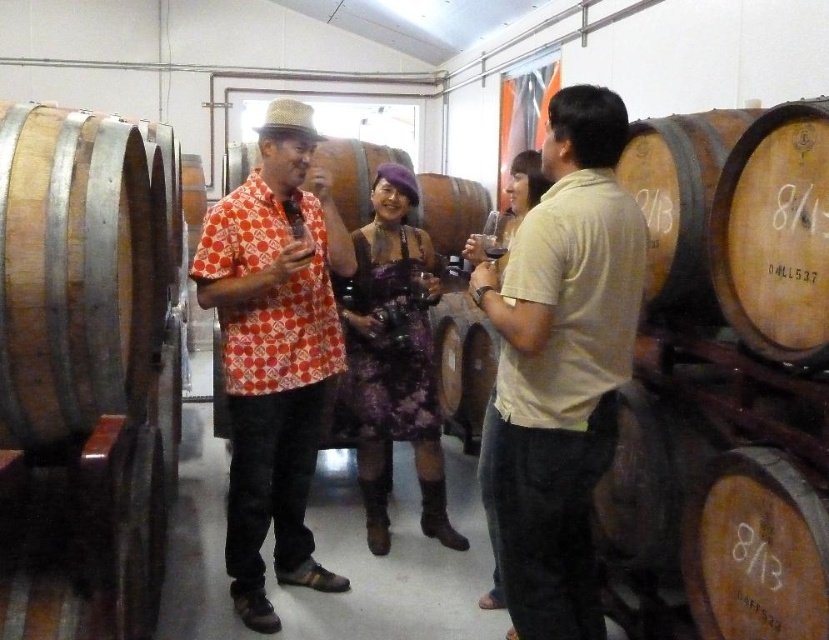
You are a photographer standing at the camera position. You want to take a photo of the printed cotton shirt at center. Is it within your reach to grab the shirt and adjust it before taking the photo?

The printed cotton shirt at center is 2.35 meters from the camera, so it is out of reach to grab and adjust without moving closer.

You are a photographer at the winery event. You need to take a group photo of the printed cotton shirt at center and the purple lace dress at center. Which one should you position on the left side of the photo to match their current arrangement?

The printed cotton shirt at center should be positioned on the left side of the photo because it is currently to the left of the purple lace dress at center.

You are a photographer at the winery event. You need to capture a photo of the printed cotton shirt at center and the dark glass wine at center. Which object is wider so that it can be framed properly?

The printed cotton shirt at center is wider than the dark glass wine at center, so it should be framed to accommodate its width.